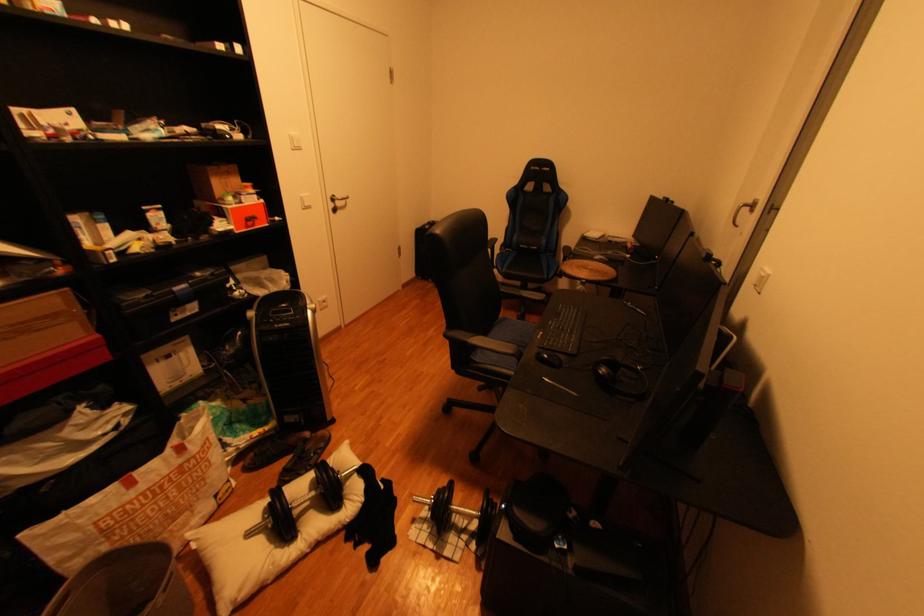
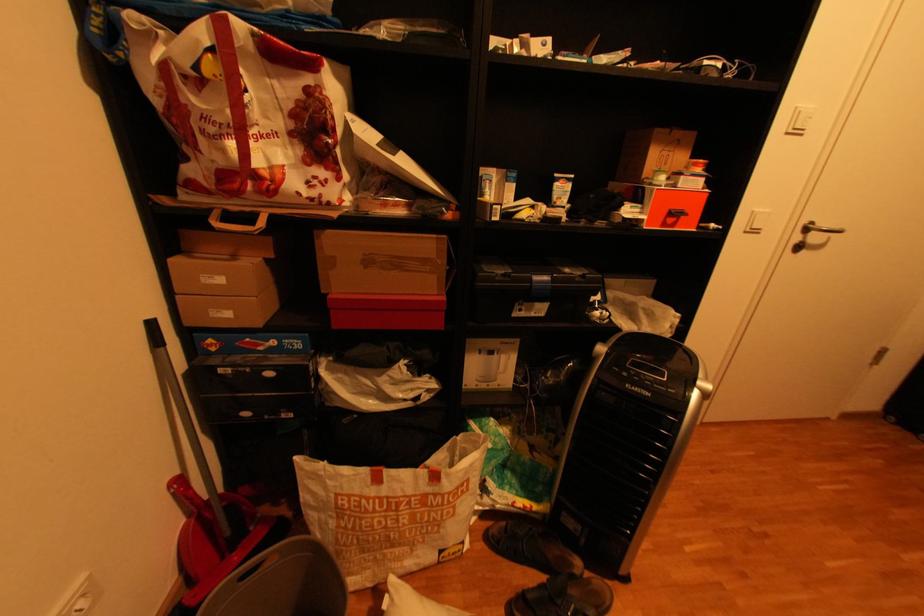
In the second image, find the point that corresponds to point (312, 196) in the first image.

(766, 209)